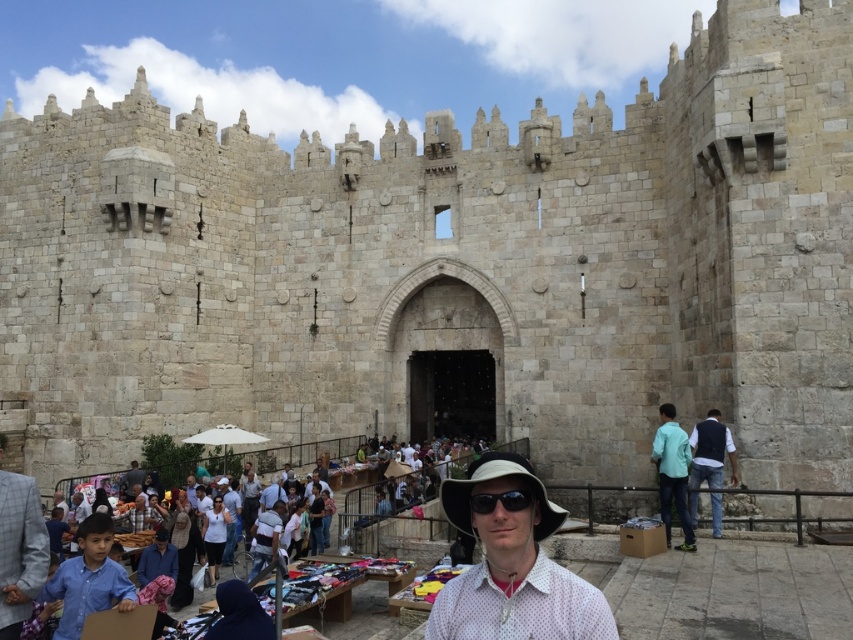
You are a photographer trying to arrange two people for a photo shoot in front of the historic stone structure. You have a person wearing a gray checkered suit at lower left and another in a light brown leather jacket at lower left. According to the scene, which one should stand to the left of the other?

The gray checkered suit at lower left should stand to the left of the light brown leather jacket at lower left as per the scene description.

You are a photographer trying to capture the man in the white matte shirt at center while ensuring the historic stone structure remains in the background. Based on the coordinates provided in the Objects Description, where should you position your camera relative to the man?

The white matte shirt at center is located at point (213, 536), so you should position your camera to the right of the man to capture him while keeping the historic stone structure in the background.

You are a photographer trying to capture a closeup of the matte black dress at center and the light brown leather jacket at center. Since you can only focus on one object at a time, which one should you choose to ensure it fills the frame more?

The matte black dress at center is larger in size than the light brown leather jacket at center, so you should focus on the matte black dress at center to ensure it fills the frame more.